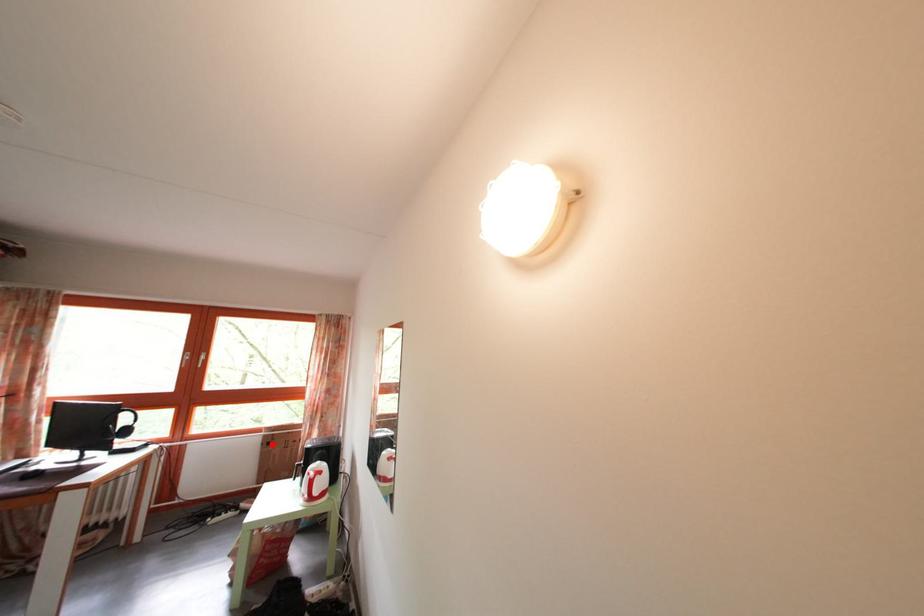
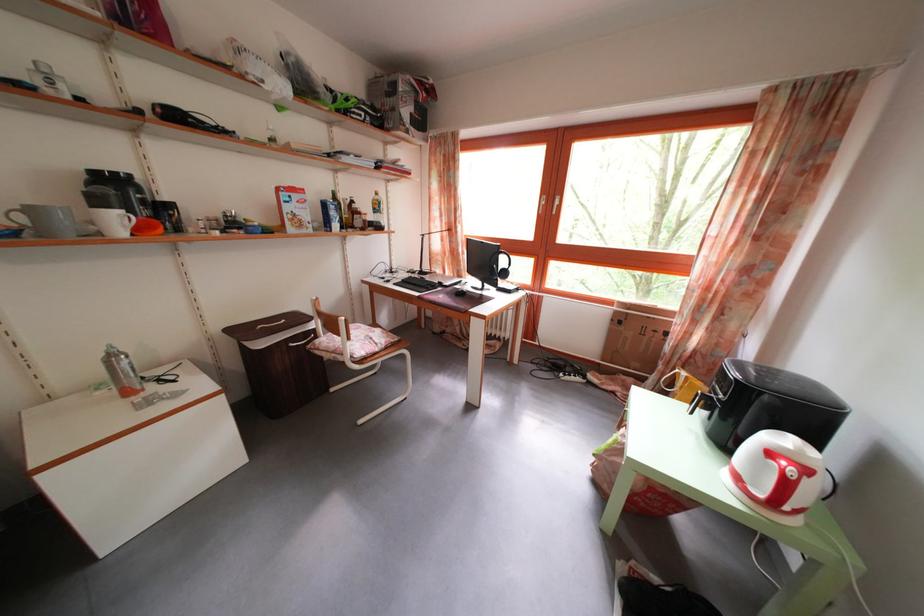
Question: A red point is marked in image1. In image2, is the corresponding 3D point closer to the camera or farther? Reply with the corresponding letter.

Choices:
 (A) The corresponding 3D point is closer.
 (B) The corresponding 3D point is farther.

Answer: (A)